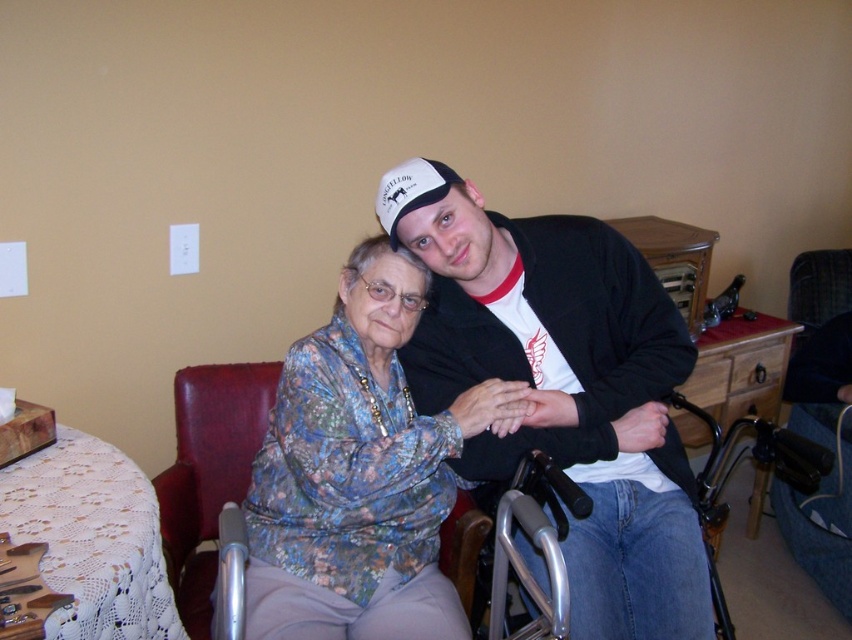
You are standing in the room and want to reach both the matte black jacket at center and the leather at left. Which item should you move toward first to get closer to both?

You should move toward the matte black jacket at center first since it is closer to you than the leather at left, so reaching it first would mean you are already closer to both items.

You are a fashion designer observing the scene. You need to place a new accessory between the matte black jacket at center and the leather at left. Based on their positions, which object should the accessory be closer to?

The matte black jacket at center is positioned on the right side of leather at left. Therefore, the accessory should be placed closer to the leather at left since it is to the left of the matte black jacket at center.